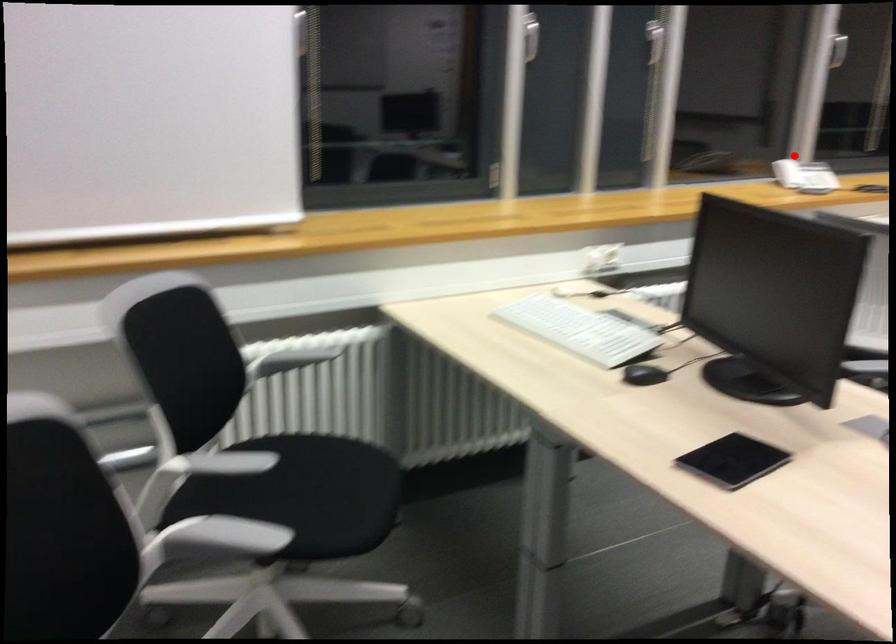
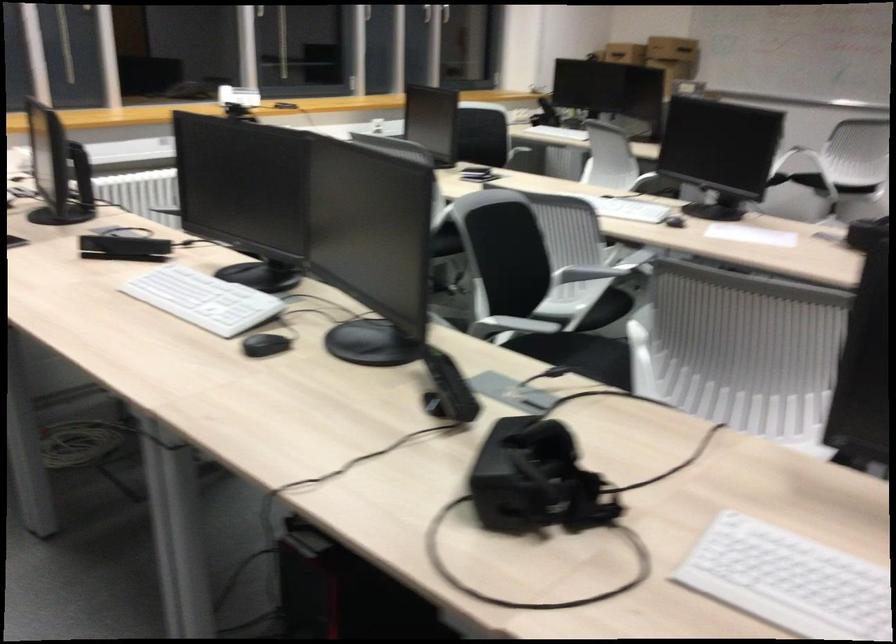
In the second image, find the point that corresponds to the highlighted location in the first image.

(238, 96)